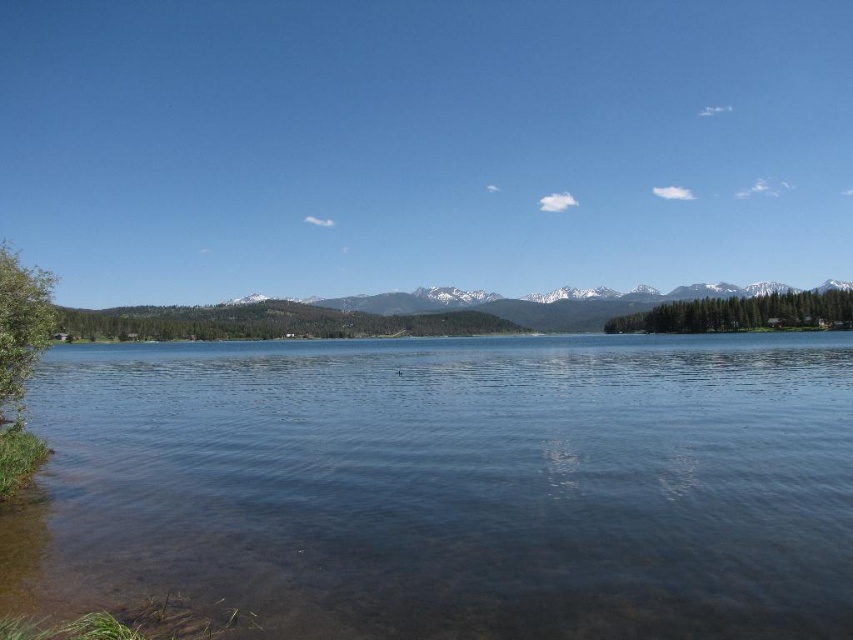
Is clear water at lower left behind snowy white mountain at center?

No, it is not.

Which of these two, clear water at lower left or snowy white mountain at center, stands shorter?

clear water at lower left

Where is `clear water at lower left`? clear water at lower left is located at coordinates (462, 483).